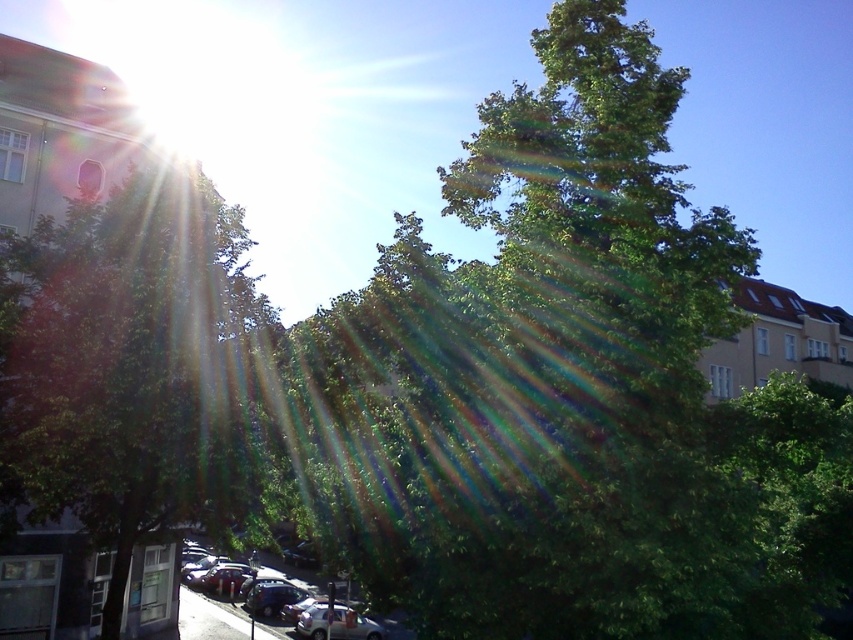
Question: Considering the real-world distances, which object is farthest from the shiny silver car at lower center?

Choices:
 (A) green leafy tree at center
 (B) green leafy tree at left

Answer: (A)

Question: Which object appears closest to the camera in this image?

Choices:
 (A) shiny silver car at lower center
 (B) green leafy tree at left
 (C) green leafy tree at center

Answer: (C)

Question: Does green leafy tree at left have a greater width compared to shiny silver car at lower center?

Choices:
 (A) yes
 (B) no

Answer: (B)

Question: Does green leafy tree at left have a smaller size compared to shiny silver car at lower center?

Choices:
 (A) yes
 (B) no

Answer: (B)

Question: Does green leafy tree at center have a lesser width compared to shiny silver car at lower center?

Choices:
 (A) yes
 (B) no

Answer: (B)

Question: Estimate the real-world distances between objects in this image. Which object is farther from the shiny silver car at lower center?

Choices:
 (A) green leafy tree at center
 (B) green leafy tree at left

Answer: (A)